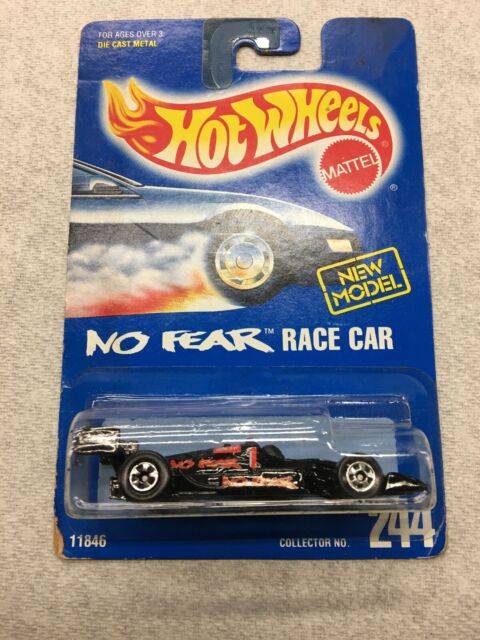
Find the location of a particular element. This screenshot has width=480, height=640. toy car is located at coordinates (217, 477).